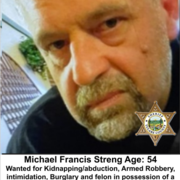
Find the location of a particular element. plant is located at coordinates (24, 44), (33, 57), (41, 72), (44, 77).